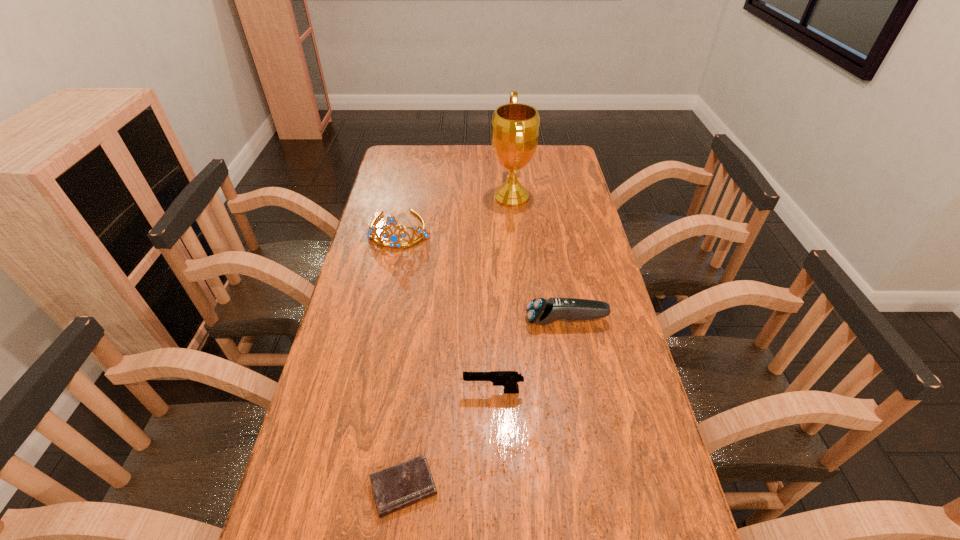
The image size is (960, 540). I want to click on vacant point located on the head of the third nearest object, so click(469, 320).

Locate an element on the screen. This screenshot has height=540, width=960. vacant region located 0.270m on the head of the third nearest object is located at coordinates click(431, 320).

Where is `vacant space located 0.060m on the head of the third nearest object`? The width and height of the screenshot is (960, 540). vacant space located 0.060m on the head of the third nearest object is located at coordinates (505, 320).

I want to click on free point located 0.050m on the front-facing side of the pistol, so click(x=444, y=392).

The image size is (960, 540). What are the coordinates of `free region located on the front-facing side of the pistol` in the screenshot? It's located at (350, 392).

I want to click on vacant area situated on the front-facing side of the pistol, so click(420, 392).

You are a GUI agent. You are given a task and a screenshot of the screen. Output one action in this format:
    pyautogui.click(x=<x>, y=<y>)
    Task: Click on the free space located on the right of the nearest object
    The height and width of the screenshot is (540, 960).
    Given the screenshot: What is the action you would take?
    pyautogui.click(x=548, y=488)

Locate an element on the screen. object located in the far edge section of the desktop is located at coordinates (515, 127).

At what (x,y) coordinates should I click in order to perform the action: click on object that is at the left edge. Please return your answer as a coordinate pair (x, y). Looking at the image, I should click on (395, 241).

Where is `object that is positioned at the right edge`? The height and width of the screenshot is (540, 960). object that is positioned at the right edge is located at coordinates (540, 311).